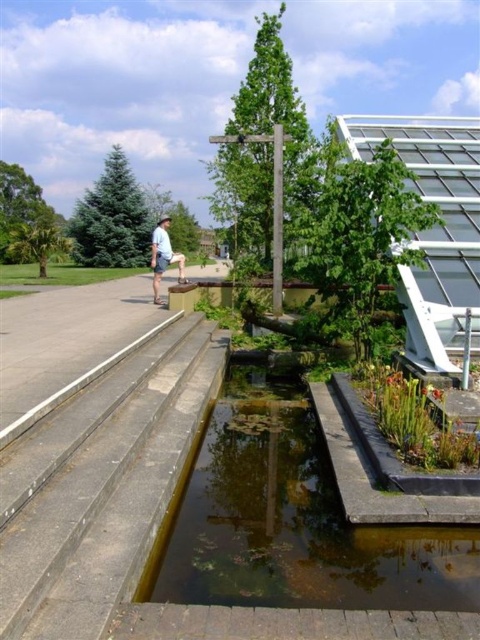
You are standing in the botanical garden scene described. There are two points marked in the image. Which point, point (417, 545) or point (165, 237), is closer to you?

Point (417, 545) is closer to the viewer than point (165, 237).

You are standing at the point marked as point (415, 419) in the image. What do you see around you?

You are standing at point (415, 419), which corresponds to green leafy plants at center. The area around you is part of a serene outdoor scene in a botanical garden setting with a water feature nearby and a modern greenhouse to the right.